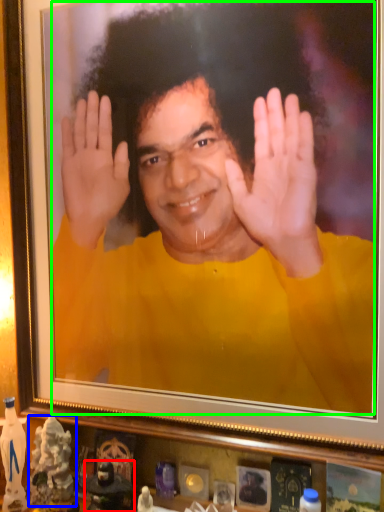
Question: Which is farther away from toy (highlighted by a red box)? toy (highlighted by a blue box) or man (highlighted by a green box)?

Choices:
 (A) toy
 (B) man

Answer: (B)